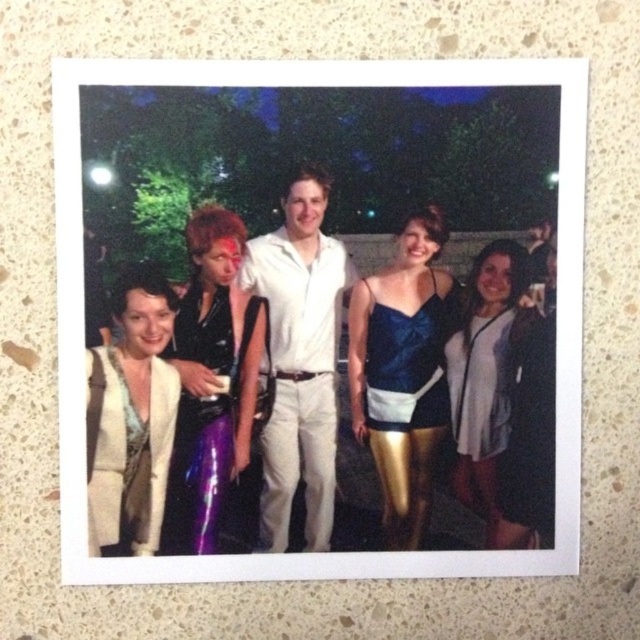
You are a photographer adjusting the camera settings to capture the scene. The camera has a depth of field that can focus on objects within a 5.5 inch range. If you focus on the matte white shirt at center, will the white matte jacket at right also be in focus?

The white matte jacket at right is 5.79 inches from the matte white shirt at center. Since the depth of field can only focus within a 5.5 inch range, the white matte jacket at right will be slightly out of focus.